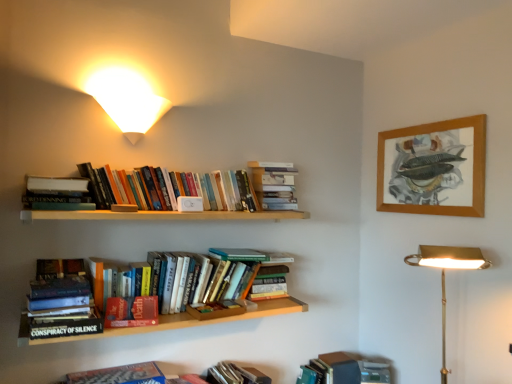
Question: Would you consider hardcover books at upper center, which is counted as the 6th book, starting from the bottom, to be distant from hardcover book at lower right, placed as the 1th book when sorted from bottom to top?

Choices:
 (A) yes
 (B) no

Answer: (A)

Question: Is hardcover books at upper center, the second book in the top-to-bottom sequence, at the left side of hardcover book at lower right, the seventh book viewed from the top?

Choices:
 (A) no
 (B) yes

Answer: (B)

Question: Is hardcover books at upper center, which is counted as the 6th book, starting from the bottom, not within hardcover book at lower right, the seventh book viewed from the top?

Choices:
 (A) yes
 (B) no

Answer: (A)

Question: Is hardcover books at upper center, which is counted as the 6th book, starting from the bottom, closer to camera compared to hardcover book at lower right, placed as the 1th book when sorted from bottom to top?

Choices:
 (A) no
 (B) yes

Answer: (B)

Question: Is the depth of hardcover books at upper center, the second book in the top-to-bottom sequence, greater than that of hardcover book at lower right, placed as the 1th book when sorted from bottom to top?

Choices:
 (A) no
 (B) yes

Answer: (A)

Question: Is hardcover books at upper center, which is counted as the 6th book, starting from the bottom, with hardcover book at lower right, the seventh book viewed from the top?

Choices:
 (A) yes
 (B) no

Answer: (B)

Question: Can we say white matte bookshelf at upper center, which appears as the 7th book when ordered from the bottom, lies outside gold brass desk lamp at lower right, acting as the 2th lamp starting from the left?

Choices:
 (A) yes
 (B) no

Answer: (A)

Question: Does white matte bookshelf at upper center, which is the first book from top to bottom, contain gold brass desk lamp at lower right, acting as the 2th lamp starting from the left?

Choices:
 (A) no
 (B) yes

Answer: (A)

Question: Considering the relative positions of white matte bookshelf at upper center, which is the first book from top to bottom, and gold brass desk lamp at lower right, acting as the first lamp starting from the bottom, in the image provided, is white matte bookshelf at upper center, which is the first book from top to bottom, behind gold brass desk lamp at lower right, acting as the first lamp starting from the bottom,?

Choices:
 (A) no
 (B) yes

Answer: (B)

Question: Considering the relative sizes of white matte bookshelf at upper center, which is the first book from top to bottom, and gold brass desk lamp at lower right, acting as the 2th lamp starting from the left, in the image provided, is white matte bookshelf at upper center, which is the first book from top to bottom, taller than gold brass desk lamp at lower right, acting as the 2th lamp starting from the left,?

Choices:
 (A) yes
 (B) no

Answer: (B)

Question: Is white matte bookshelf at upper center, which is the first book from top to bottom, facing towards gold brass desk lamp at lower right, the second lamp when ordered from top to bottom?

Choices:
 (A) yes
 (B) no

Answer: (B)

Question: Can you confirm if white matte bookshelf at upper center, which is the first book from top to bottom, is positioned to the left of gold brass desk lamp at lower right, acting as the 2th lamp starting from the left?

Choices:
 (A) yes
 (B) no

Answer: (A)

Question: Considering the relative positions of gold brass desk lamp at lower right, which is counted as the first lamp, starting from the right, and hardcover book at upper left, the 5th book ordered from the bottom, in the image provided, is gold brass desk lamp at lower right, which is counted as the first lamp, starting from the right, behind hardcover book at upper left, the 5th book ordered from the bottom,?

Choices:
 (A) yes
 (B) no

Answer: (B)